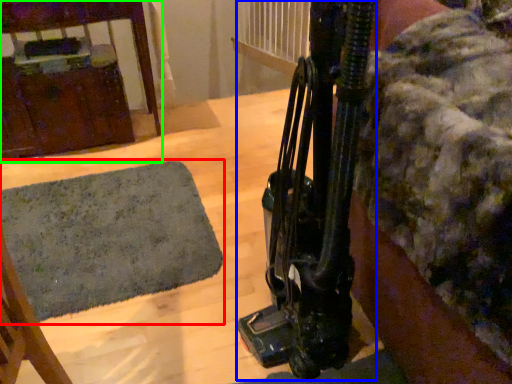
Question: Which object is the farthest from mat (highlighted by a red box)? Choose among these: equipment (highlighted by a blue box) or furniture (highlighted by a green box).

Choices:
 (A) equipment
 (B) furniture

Answer: (A)